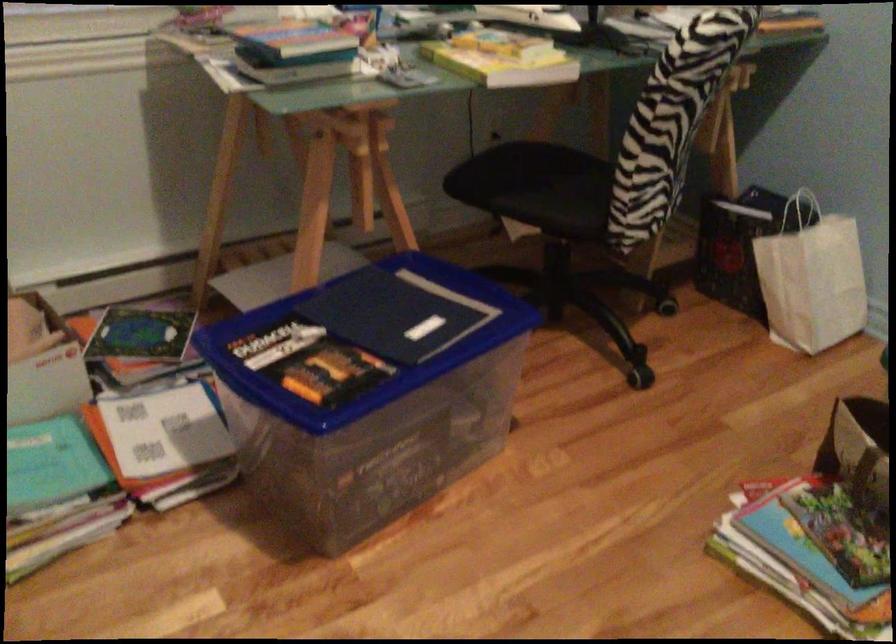
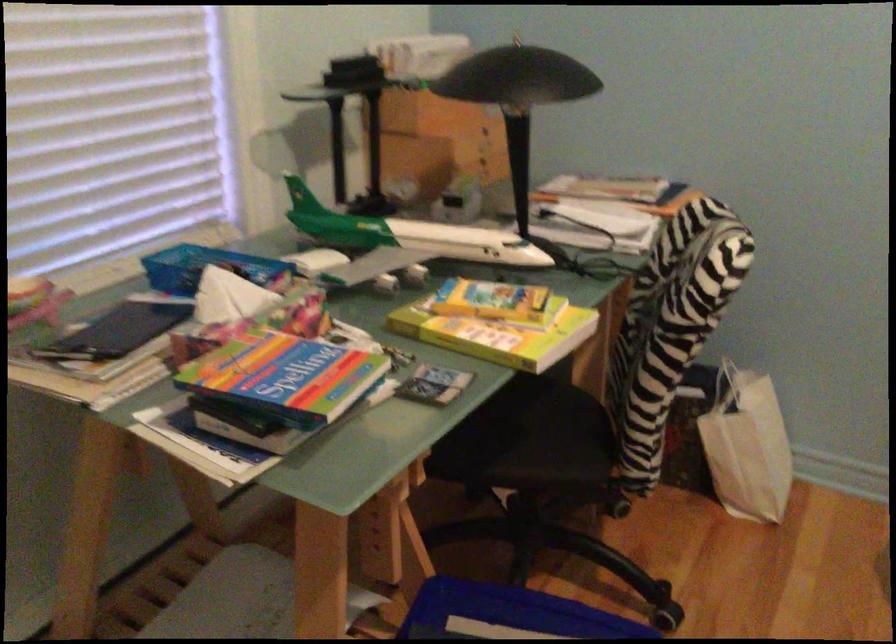
From the picture: Which direction would the cameraman need to move to produce the second image?

The cameraman moved toward left, forward.